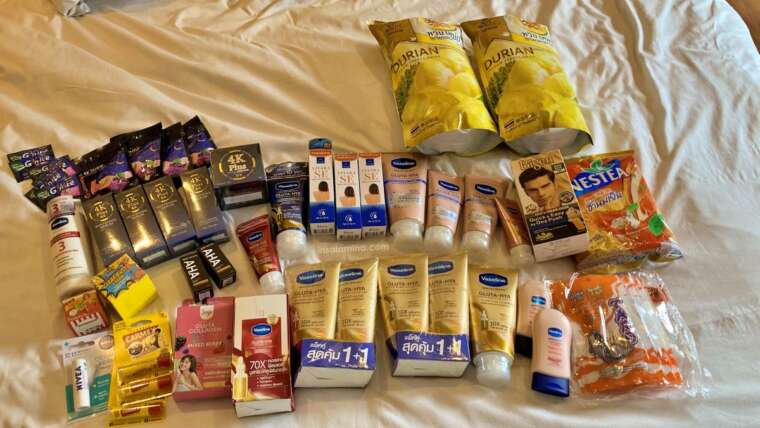
The width and height of the screenshot is (760, 428). I want to click on peach color containers, so click(410, 213), click(434, 193), click(480, 204), click(534, 287), click(555, 322).